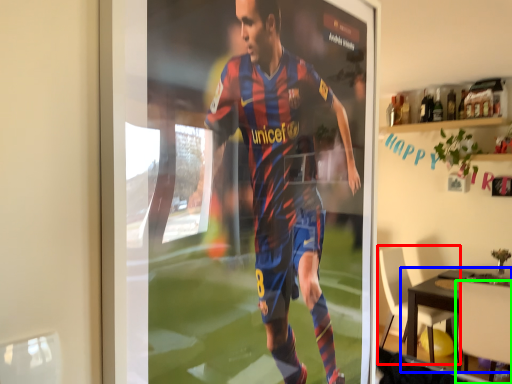
Question: Which object is positioned farthest from chair (highlighted by a red box)? Select from table (highlighted by a blue box) and chair (highlighted by a green box).

Choices:
 (A) table
 (B) chair

Answer: (B)